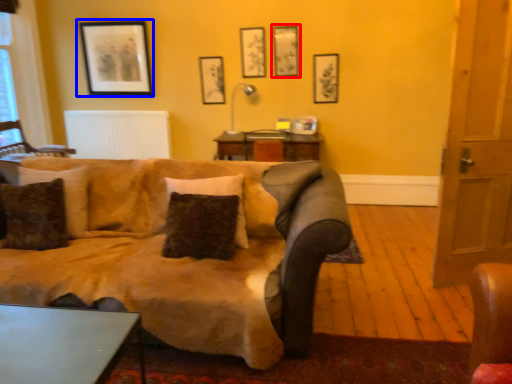
Question: Among these objects, which one is farthest to the camera, picture frame (highlighted by a red box) or picture frame (highlighted by a blue box)?

Choices:
 (A) picture frame
 (B) picture frame

Answer: (B)